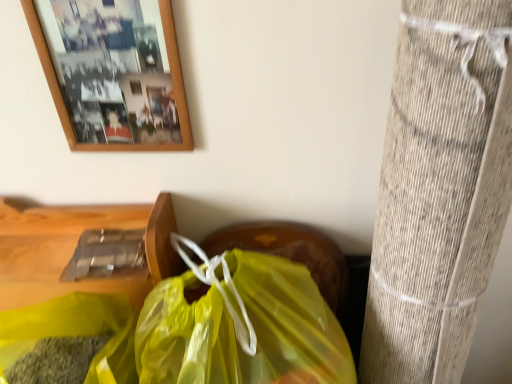
This screenshot has width=512, height=384. In order to click on wooden picture frame at upper left in this screenshot , I will do `click(113, 73)`.

Describe the element at coordinates (113, 73) in the screenshot. I see `wooden picture frame at upper left` at that location.

The width and height of the screenshot is (512, 384). Find the location of `translucent yellow plastic bag at lower center`. translucent yellow plastic bag at lower center is located at coordinates (240, 324).

What do you see at coordinates (240, 324) in the screenshot? I see `translucent yellow plastic bag at lower center` at bounding box center [240, 324].

I want to click on wooden picture frame at upper left, so click(113, 73).

Does wooden picture frame at upper left appear on the right side of translucent yellow plastic bag at lower center?

No.

Which object is closer to the camera taking this photo, wooden picture frame at upper left or translucent yellow plastic bag at lower center?

Positioned in front is translucent yellow plastic bag at lower center.

Which is in front, point (159, 22) or point (241, 377)?

The point (241, 377) is in front.

From the image's perspective, is wooden picture frame at upper left located beneath translucent yellow plastic bag at lower center?

Incorrect, from the image's perspective, wooden picture frame at upper left is higher than translucent yellow plastic bag at lower center.

From a real-world perspective, who is located higher, wooden picture frame at upper left or translucent yellow plastic bag at lower center?

wooden picture frame at upper left, from a real-world perspective.

Can you confirm if wooden picture frame at upper left is thinner than translucent yellow plastic bag at lower center?

Yes.

Can you confirm if wooden picture frame at upper left is taller than translucent yellow plastic bag at lower center?

Incorrect, the height of wooden picture frame at upper left is not larger of that of translucent yellow plastic bag at lower center.

Between wooden picture frame at upper left and translucent yellow plastic bag at lower center, which one has larger size?

translucent yellow plastic bag at lower center.

Is wooden picture frame at upper left inside or outside of translucent yellow plastic bag at lower center?

wooden picture frame at upper left lies outside translucent yellow plastic bag at lower center.

Is wooden picture frame at upper left not close to translucent yellow plastic bag at lower center?

No, wooden picture frame at upper left is not far away from translucent yellow plastic bag at lower center.

Is wooden picture frame at upper left positioned with its back to translucent yellow plastic bag at lower center?

No, wooden picture frame at upper left's orientation is not away from translucent yellow plastic bag at lower center.

How many degrees apart are the facing directions of wooden picture frame at upper left and translucent yellow plastic bag at lower center?

wooden picture frame at upper left and translucent yellow plastic bag at lower center are facing 28.3 degrees away from each other.

Identify the location of picture frame behind the translucent yellow plastic bag at lower center. (113, 73).

Which is more to the left, translucent yellow plastic bag at lower center or wooden picture frame at upper left?

From the viewer's perspective, wooden picture frame at upper left appears more on the left side.

Considering the relative positions of translucent yellow plastic bag at lower center and wooden picture frame at upper left in the image provided, is translucent yellow plastic bag at lower center behind wooden picture frame at upper left?

That is False.

Does point (223, 295) lie behind point (90, 142)?

That is False.

From the image's perspective, is translucent yellow plastic bag at lower center above or below wooden picture frame at upper left?

translucent yellow plastic bag at lower center is situated lower than wooden picture frame at upper left in the image.

From a real-world perspective, is translucent yellow plastic bag at lower center under wooden picture frame at upper left?

Yes, from a real-world perspective, translucent yellow plastic bag at lower center is under wooden picture frame at upper left.

From the picture: Is translucent yellow plastic bag at lower center wider than wooden picture frame at upper left?

Yes, translucent yellow plastic bag at lower center is wider than wooden picture frame at upper left.

Who is shorter, translucent yellow plastic bag at lower center or wooden picture frame at upper left?

Standing shorter between the two is wooden picture frame at upper left.

Which of these two, translucent yellow plastic bag at lower center or wooden picture frame at upper left, is smaller?

wooden picture frame at upper left is smaller.

Could wooden picture frame at upper left be considered to be inside translucent yellow plastic bag at lower center?

→ Actually, wooden picture frame at upper left is outside translucent yellow plastic bag at lower center.

Is translucent yellow plastic bag at lower center directly adjacent to wooden picture frame at upper left?

No, translucent yellow plastic bag at lower center is not in contact with wooden picture frame at upper left.

Is translucent yellow plastic bag at lower center facing away from wooden picture frame at upper left?

No, translucent yellow plastic bag at lower center is not facing away from wooden picture frame at upper left.

Can you tell me how much translucent yellow plastic bag at lower center and wooden picture frame at upper left differ in facing direction?

translucent yellow plastic bag at lower center and wooden picture frame at upper left are facing 28.3 degrees away from each other.

Identify the location of plastic bag below the wooden picture frame at upper left (from the image's perspective). This screenshot has height=384, width=512. (240, 324).

Locate an element on the screen. The height and width of the screenshot is (384, 512). picture frame that appears above the translucent yellow plastic bag at lower center (from a real-world perspective) is located at coordinates (113, 73).

You are a GUI agent. You are given a task and a screenshot of the screen. Output one action in this format:
    pyautogui.click(x=<x>, y=<y>)
    Task: Click on the picture frame located above the translucent yellow plastic bag at lower center (from the image's perspective)
    
    Given the screenshot: What is the action you would take?
    pyautogui.click(x=113, y=73)